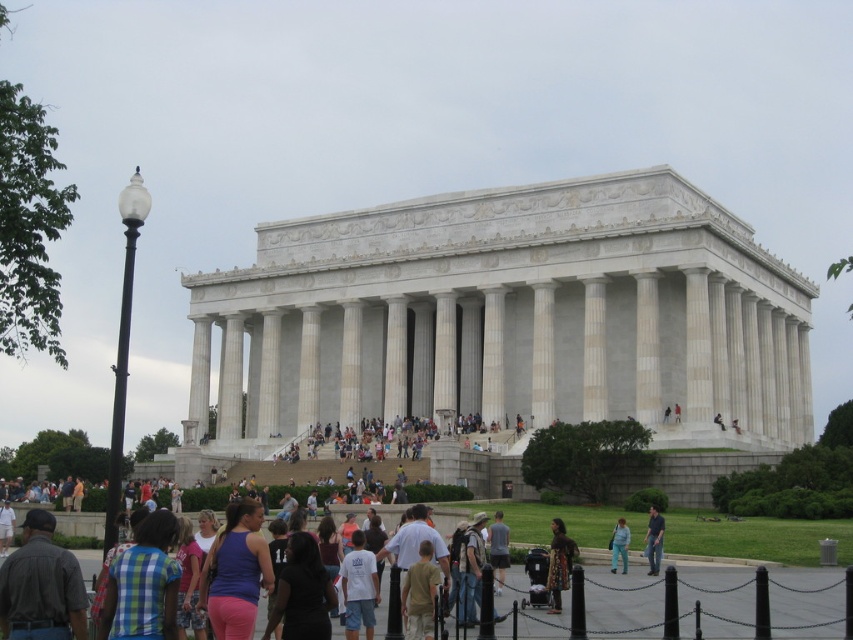
You are a photographer standing at the base of the Lincoln Memorial steps. You want to capture a photo of both the patterned fabric dress at center and the jeans at center in the same frame. Given that your camera has a maximum focal length that allows capturing objects up to 10 meters apart, will you be able to include both subjects in your shot?

The distance between the patterned fabric dress at center and the jeans at center is 9.04 meters, which is within the camera maximum focal length of 10 meters. Therefore, you can include both subjects in the shot.

You are a photographer planning to capture a group photo of the dark gray shirt at lower left and the purple matte tank top at center. Considering their sizes, which one should be placed closer to the camera to maintain similar apparent sizes in the photo?

The dark gray shirt at lower left is wider than the purple matte tank top at center. To maintain similar apparent sizes, the purple matte tank top at center should be placed closer to the camera since it is narrower.